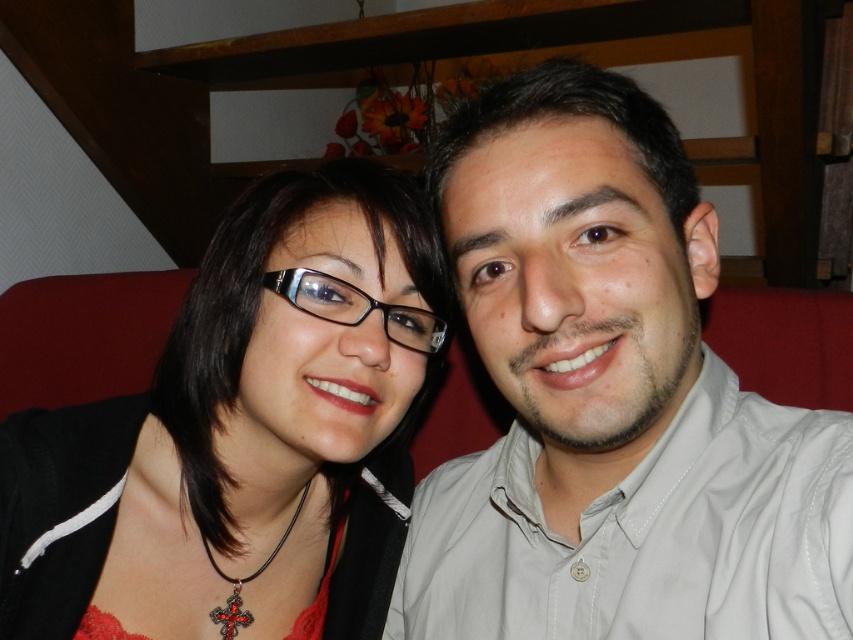
Question: Can you confirm if light beige shirt at center is smaller than matte black glasses at center?

Choices:
 (A) no
 (B) yes

Answer: (A)

Question: Which object is positioned closest to the transparent plastic glasses at center?

Choices:
 (A) light beige shirt at center
 (B) matte black glasses at center

Answer: (B)

Question: Among these points, which one is farthest from the camera?

Choices:
 (A) (421, 326)
 (B) (706, 554)

Answer: (A)

Question: Is light beige shirt at center bigger than transparent plastic glasses at center?

Choices:
 (A) no
 (B) yes

Answer: (B)

Question: Is light beige shirt at center below transparent plastic glasses at center?

Choices:
 (A) yes
 (B) no

Answer: (A)

Question: Which object is positioned farthest from the light beige shirt at center?

Choices:
 (A) matte black glasses at center
 (B) transparent plastic glasses at center

Answer: (B)